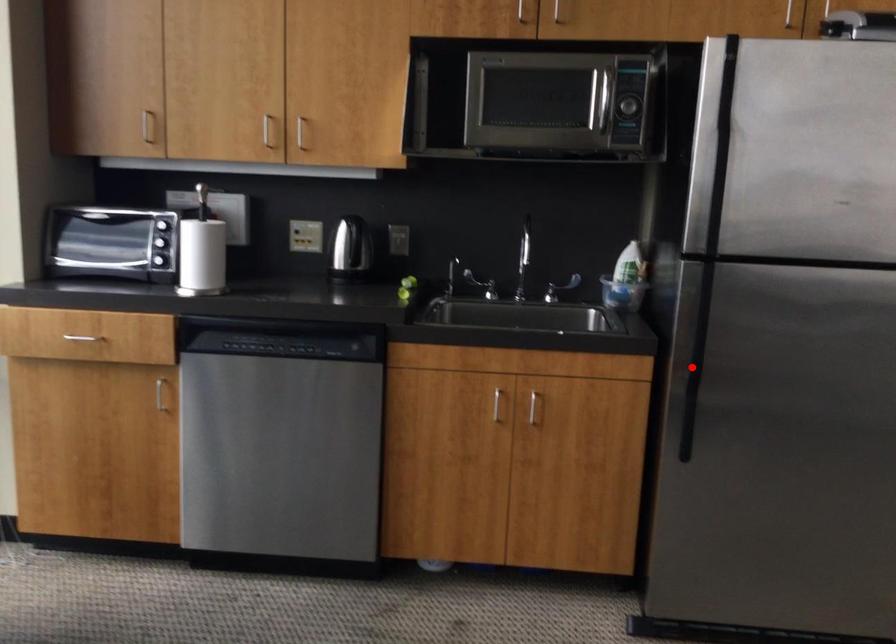
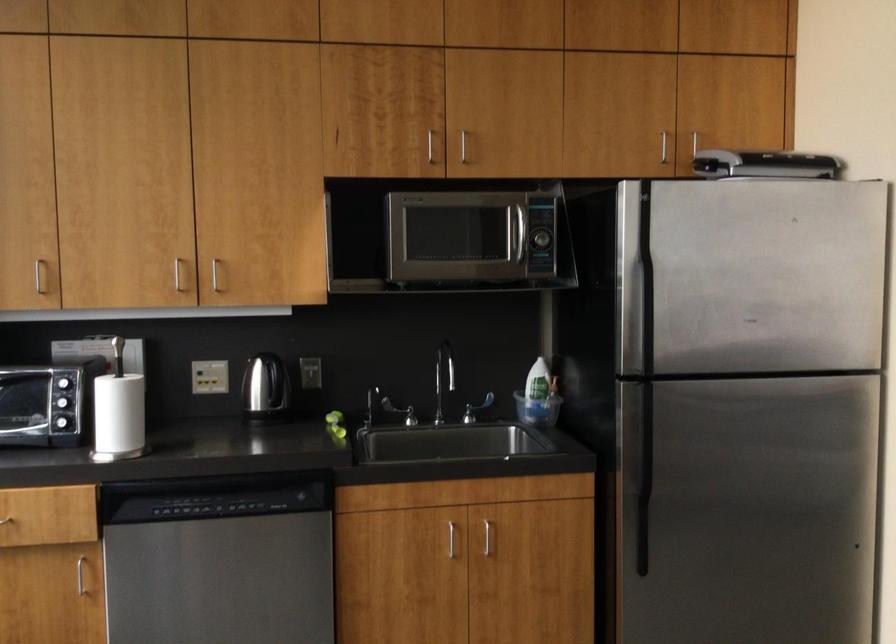
Where in the second image is the point corresponding to the highlighted location from the first image?

(643, 480)